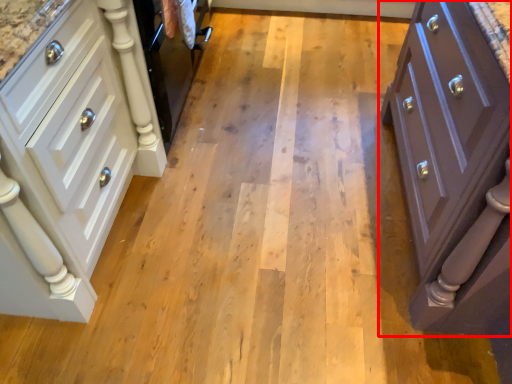
Question: From the image's perspective, what is the correct spatial positioning of chest of drawers (annotated by the red box) in reference to chest of drawers?

Choices:
 (A) above
 (B) below

Answer: (B)